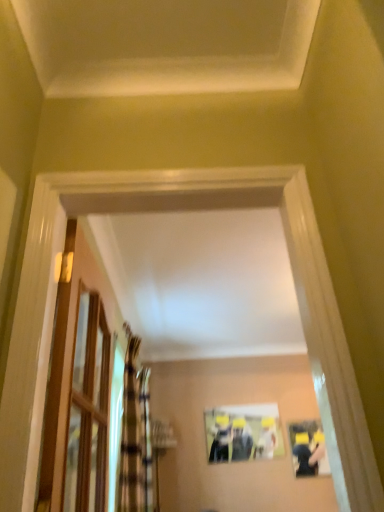
Measure the distance between point [237,450] and camera.

Point [237,450] and camera are 14.02 feet apart from each other.

Measure the distance between point [149,489] and camera.

Point [149,489] and camera are 9.95 feet apart from each other.

Locate an element on the screen. clear glass door at left is located at coordinates (88, 409).

Describe the element at coordinates (88, 409) in the screenshot. I see `clear glass door at left` at that location.

This screenshot has height=512, width=384. What do you see at coordinates (134, 435) in the screenshot?
I see `gold textured curtain at left, arranged as the second curtain when viewed from the back` at bounding box center [134, 435].

Image resolution: width=384 pixels, height=512 pixels. What do you see at coordinates (308, 448) in the screenshot?
I see `matte black couple at center` at bounding box center [308, 448].

Identify the location of matte plastic picture frame at center. (243, 433).

Between matte plastic picture frame at center and clear glass door at left, which one has smaller width?

matte plastic picture frame at center.

Does matte plastic picture frame at center have a smaller size compared to clear glass door at left?

Yes.

In order to click on glass door below the matte plastic picture frame at center (from a real-world perspective) in this screenshot , I will do `click(88, 409)`.

Is plaid fabric curtain at left, the 1th curtain from the back, positioned beyond the bounds of matte black couple at center?

Absolutely, plaid fabric curtain at left, the 1th curtain from the back, is external to matte black couple at center.

Considering their positions, is plaid fabric curtain at left, the 1th curtain from the back, located in front of or behind matte black couple at center?

In the image, plaid fabric curtain at left, the 1th curtain from the back, appears in front of matte black couple at center.

Does point (152, 458) lie behind point (298, 463)?

No, it is in front of (298, 463).

Consider the image. Does plaid fabric curtain at left, which is the 2th curtain from front to back, have a smaller size compared to matte black couple at center?

Incorrect, plaid fabric curtain at left, which is the 2th curtain from front to back, is not smaller in size than matte black couple at center.

Based on their positions, is matte black couple at center located to the left or right of matte plastic picture frame at center?

matte black couple at center is positioned on matte plastic picture frame at center's right side.

From a real-world perspective, between matte black couple at center and matte plastic picture frame at center, who is vertically lower?

matte black couple at center.

Is matte black couple at center far away from matte plastic picture frame at center?

No, there isn't a large distance between matte black couple at center and matte plastic picture frame at center.

Can you tell me how much matte black couple at center and matte plastic picture frame at center differ in facing direction?

0.631 degrees separate the facing orientations of matte black couple at center and matte plastic picture frame at center.

From a real-world perspective, is matte black couple at center located beneath gold textured curtain at left, arranged as the second curtain when viewed from the back?

Indeed, from a real-world perspective, matte black couple at center is positioned beneath gold textured curtain at left, arranged as the second curtain when viewed from the back.

Is point (316, 439) positioned before point (151, 455)?

No, (316, 439) is further to viewer.

Is matte black couple at center facing towards gold textured curtain at left, which is the 1th curtain from front to back?

No.

In the scene shown: Considering the relative positions of matte black couple at center and gold textured curtain at left, which is the 1th curtain from front to back, in the image provided, is matte black couple at center behind gold textured curtain at left, which is the 1th curtain from front to back,?

That is True.

From the image's perspective, which object appears higher, clear glass door at left or gold textured curtain at left, arranged as the second curtain when viewed from the back?

clear glass door at left appears higher in the image.

Is clear glass door at left situated inside gold textured curtain at left, which is the 1th curtain from front to back, or outside?

clear glass door at left is outside gold textured curtain at left, which is the 1th curtain from front to back.

Between clear glass door at left and gold textured curtain at left, arranged as the second curtain when viewed from the back, which one has smaller size?

With smaller size is clear glass door at left.

From a real-world perspective, which object rests below the other?

gold textured curtain at left, arranged as the second curtain when viewed from the back, is physically lower.

Is point (215, 419) closer to viewer compared to point (116, 480)?

No, (215, 419) is behind (116, 480).

Is matte plastic picture frame at center positioned beyond the bounds of gold textured curtain at left, which is the 1th curtain from front to back?

That's correct, matte plastic picture frame at center is outside of gold textured curtain at left, which is the 1th curtain from front to back.

Based on the photo, which of these two, matte plastic picture frame at center or gold textured curtain at left, which is the 1th curtain from front to back, stands taller?

With more height is gold textured curtain at left, which is the 1th curtain from front to back.

Considering the positions of objects clear glass door at left and plaid fabric curtain at left, the 1th curtain from the back, in the image provided, who is more to the right, clear glass door at left or plaid fabric curtain at left, the 1th curtain from the back,?

Positioned to the right is clear glass door at left.

From the image's perspective, is clear glass door at left on plaid fabric curtain at left, which is the 2th curtain from front to back?

Yes, from the image's perspective, clear glass door at left is above plaid fabric curtain at left, which is the 2th curtain from front to back.

In the scene shown: Can you confirm if clear glass door at left is thinner than plaid fabric curtain at left, which is the 2th curtain from front to back?

Yes.

From the image's perspective, count 2nd curtains downward from the clear glass door at left and point to it. Please provide its 2D coordinates.

[(146, 437)]

This screenshot has height=512, width=384. What are the coordinates of `picture frame that is behind the clear glass door at left` in the screenshot? It's located at (243, 433).

From the matte black couple at center, count 1st curtains forward and point to it. Please provide its 2D coordinates.

[(146, 437)]

Based on their spatial positions, is plaid fabric curtain at left, which is the 2th curtain from front to back, or matte black couple at center closer to gold textured curtain at left, which is the 1th curtain from front to back?

Based on the image, plaid fabric curtain at left, which is the 2th curtain from front to back, appears to be nearer to gold textured curtain at left, which is the 1th curtain from front to back.

From the image, which object appears to be nearer to matte black couple at center, matte plastic picture frame at center or plaid fabric curtain at left, which is the 2th curtain from front to back?

Based on the image, matte plastic picture frame at center appears to be nearer to matte black couple at center.

From the picture: From the image, which object appears to be nearer to clear glass door at left, matte black couple at center or plaid fabric curtain at left, the 1th curtain from the back?

plaid fabric curtain at left, the 1th curtain from the back, is positioned closer to the anchor clear glass door at left.

From the image, which object appears to be nearer to matte black couple at center, plaid fabric curtain at left, which is the 2th curtain from front to back, or matte plastic picture frame at center?

Based on the image, matte plastic picture frame at center appears to be nearer to matte black couple at center.

Looking at the image, which one is located further to gold textured curtain at left, arranged as the second curtain when viewed from the back, plaid fabric curtain at left, the 1th curtain from the back, or matte plastic picture frame at center?

The object further to gold textured curtain at left, arranged as the second curtain when viewed from the back, is matte plastic picture frame at center.

From the image, which object appears to be nearer to matte black couple at center, matte plastic picture frame at center or clear glass door at left?

matte plastic picture frame at center is closer to matte black couple at center.

Considering their positions, is matte black couple at center positioned closer to gold textured curtain at left, arranged as the second curtain when viewed from the back, than matte plastic picture frame at center?

Among the two, matte plastic picture frame at center is located nearer to gold textured curtain at left, arranged as the second curtain when viewed from the back.

Estimate the real-world distances between objects in this image. Which object is closer to plaid fabric curtain at left, the 1th curtain from the back, gold textured curtain at left, arranged as the second curtain when viewed from the back, or matte plastic picture frame at center?

gold textured curtain at left, arranged as the second curtain when viewed from the back.

I want to click on curtain situated between plaid fabric curtain at left, which is the 2th curtain from front to back, and matte black couple at center from left to right, so click(134, 435).

You are a GUI agent. You are given a task and a screenshot of the screen. Output one action in this format:
    pyautogui.click(x=<x>, y=<y>)
    Task: Click on the couple between gold textured curtain at left, arranged as the second curtain when viewed from the back, and matte plastic picture frame at center from front to back
    The height and width of the screenshot is (512, 384).
    Given the screenshot: What is the action you would take?
    pyautogui.click(x=308, y=448)

The width and height of the screenshot is (384, 512). In order to click on couple positioned between clear glass door at left and matte plastic picture frame at center from near to far in this screenshot , I will do `click(308, 448)`.

Where is `curtain between gold textured curtain at left, which is the 1th curtain from front to back, and matte plastic picture frame at center, along the z-axis`? curtain between gold textured curtain at left, which is the 1th curtain from front to back, and matte plastic picture frame at center, along the z-axis is located at coordinates tap(146, 437).